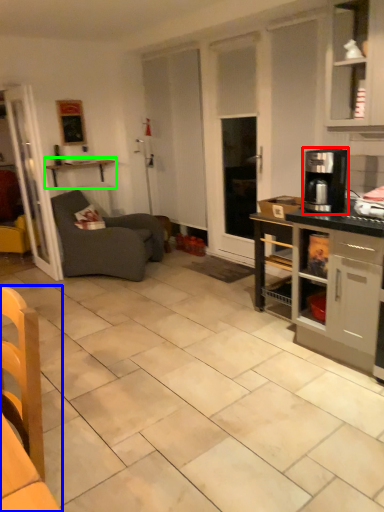
Question: Which object is positioned closest to coffee maker (highlighted by a red box)? Select from chair (highlighted by a blue box) and shelf (highlighted by a green box).

Choices:
 (A) chair
 (B) shelf

Answer: (A)